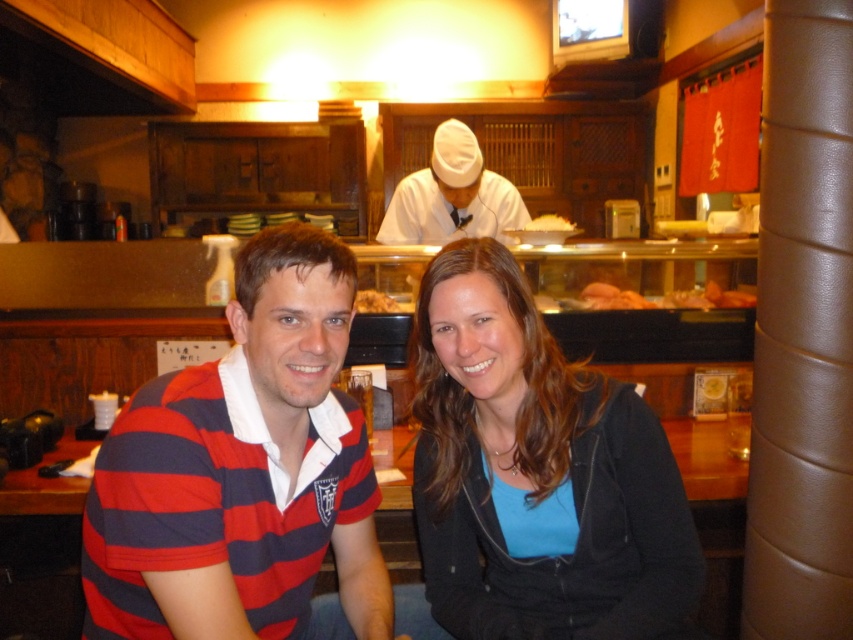
Question: Which point is closer to the camera?

Choices:
 (A) (363, 289)
 (B) (407, 224)
 (C) (480, 452)

Answer: (C)

Question: Based on their relative distances, which object is nearer to the blue matte shirt at center?

Choices:
 (A) shiny pink salmon at center
 (B) white matte chef hat at upper center

Answer: (A)

Question: Considering the relative positions of blue matte shirt at center and white matte chef hat at upper center in the image provided, where is blue matte shirt at center located with respect to white matte chef hat at upper center?

Choices:
 (A) below
 (B) above

Answer: (A)

Question: Is striped cotton polo shirt at center above white matte chef hat at upper center?

Choices:
 (A) yes
 (B) no

Answer: (B)

Question: Which point appears farthest from the camera in this image?

Choices:
 (A) (456, 198)
 (B) (567, 230)
 (C) (198, 573)

Answer: (A)

Question: Does blue matte shirt at center lie in front of shiny pink salmon at center?

Choices:
 (A) no
 (B) yes

Answer: (B)